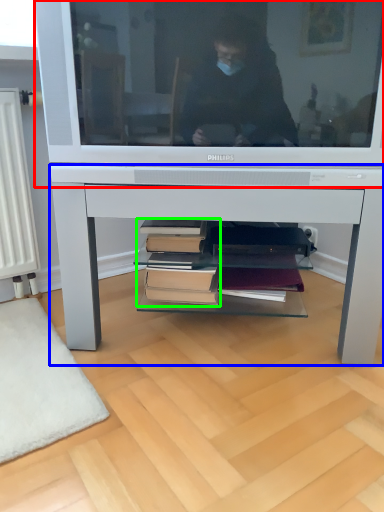
Question: Which object is positioned closest to television (highlighted by a red box)? Select from desk (highlighted by a blue box) and book (highlighted by a green box).

Choices:
 (A) desk
 (B) book

Answer: (A)